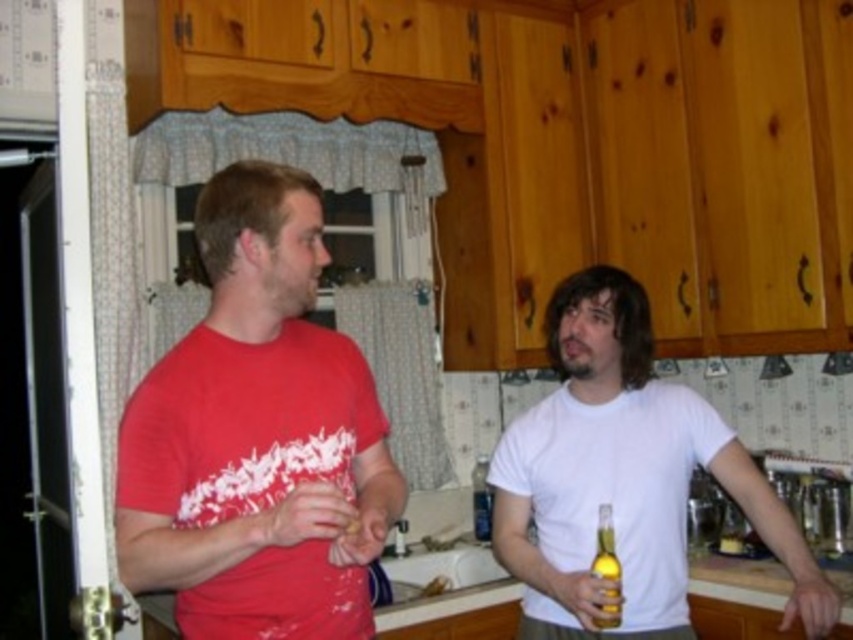
Between point (381, 493) and point (482, 486), which one is positioned behind?

The point (482, 486) is behind.

You are a GUI agent. You are given a task and a screenshot of the screen. Output one action in this format:
    pyautogui.click(x=<x>, y=<y>)
    Task: Click on the matte red t-shirt at left
    Image resolution: width=853 pixels, height=640 pixels.
    Given the screenshot: What is the action you would take?
    pyautogui.click(x=257, y=436)

Is matte red t-shirt at left taller than white matte shirt at center?

Indeed, matte red t-shirt at left has a greater height compared to white matte shirt at center.

Who is more forward, (177, 541) or (683, 496)?

Point (177, 541) is more forward.

Image resolution: width=853 pixels, height=640 pixels. In order to click on matte red t-shirt at left in this screenshot , I will do `click(257, 436)`.

Does white matte shirt at center have a larger size compared to translucent glass bottle at center?

Yes.

Who is more distant from viewer, (558,321) or (485,476)?

The point (485,476) is more distant.

Identify the location of white matte shirt at center. The image size is (853, 640). coord(624,477).